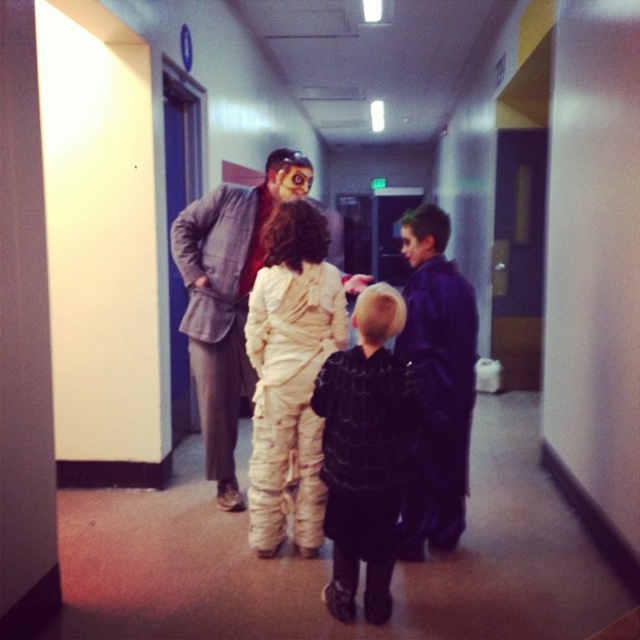
Question: Is white mummy costume at center closer to the viewer compared to black textured coat at center?

Choices:
 (A) no
 (B) yes

Answer: (A)

Question: Which object is farther from the camera taking this photo?

Choices:
 (A) dark purple coat at center
 (B) matte gray suit at center
 (C) white mummy at center

Answer: (B)

Question: Can you confirm if black textured coat at center is positioned below dark purple coat at center?

Choices:
 (A) no
 (B) yes

Answer: (B)

Question: Among these points, which one is nearest to the camera?

Choices:
 (A) (304, 257)
 (B) (381, 502)
 (C) (428, 512)
 (D) (208, 448)

Answer: (B)

Question: Which point is farther to the camera?

Choices:
 (A) dark purple coat at center
 (B) black textured coat at center
 (C) white mummy costume at center

Answer: (C)

Question: Can you confirm if white mummy costume at center is positioned above dark purple coat at center?

Choices:
 (A) no
 (B) yes

Answer: (B)